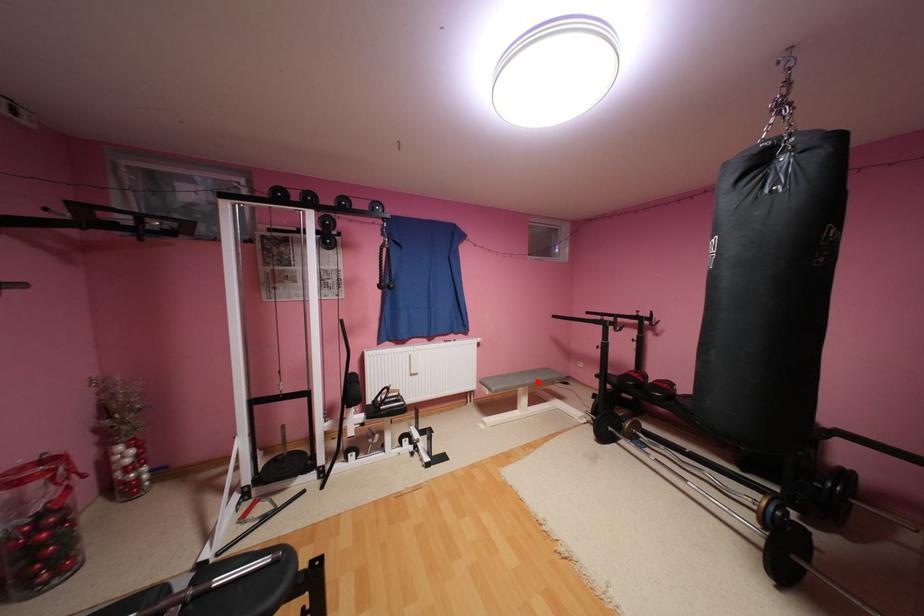
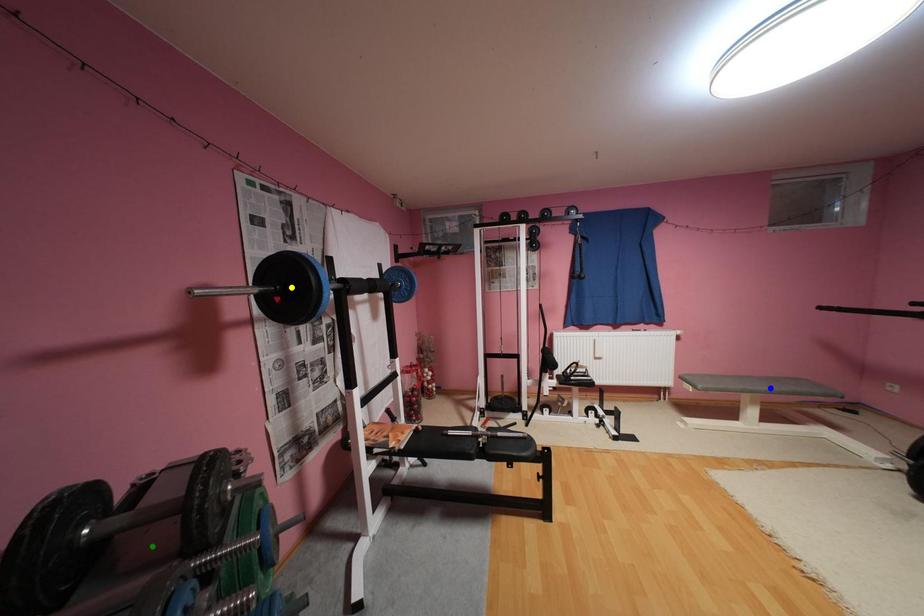
Question: I am providing you with two images of the same scene from different viewpoints. A red point is marked on the first image. You are given multiple points on the second image. Which mark in image 2 goes with the point in image 1?

Choices:
 (A) blue point
 (B) yellow point
 (C) green point

Answer: (A)